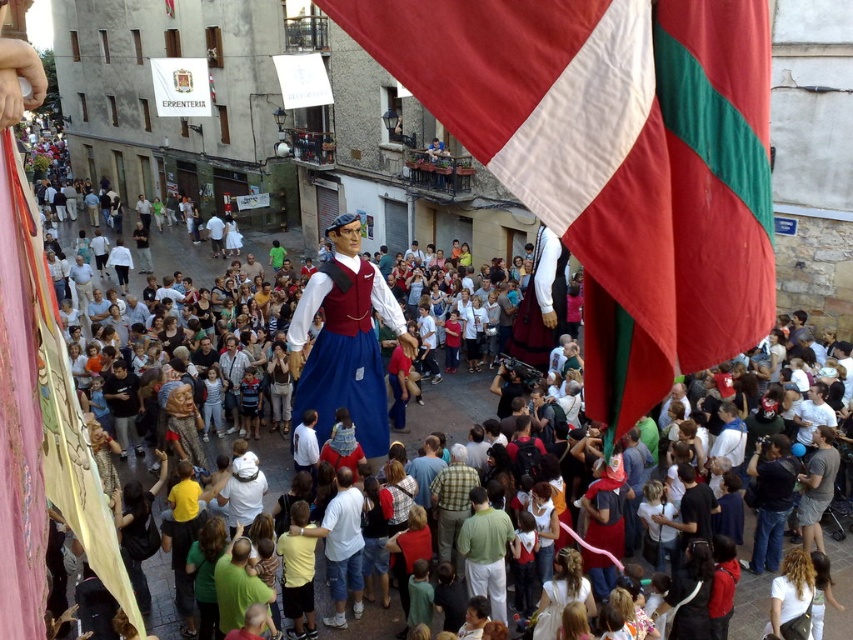
Describe the element at coordinates (345, 340) in the screenshot. I see `velvet blue costume at center` at that location.

Can you confirm if velvet blue costume at center is shorter than green plaid shirt at center?

No, velvet blue costume at center is not shorter than green plaid shirt at center.

Who is more forward, (349, 250) or (437, 512)?

Point (437, 512)

Where is `velvet blue costume at center`? The width and height of the screenshot is (853, 640). velvet blue costume at center is located at coordinates (345, 340).

Between point (479, 572) and point (459, 492), which one is positioned behind?

The point (459, 492) is more distant.

Who is lower down, green cotton shirt at center or green plaid shirt at center?

green cotton shirt at center

Is point (502, 618) in front of point (451, 541)?

Yes, it is.

Image resolution: width=853 pixels, height=640 pixels. I want to click on green cotton shirt at center, so click(485, 552).

Can you confirm if red fabric flag at center is bigger than green plaid shirt at center?

Correct, red fabric flag at center is larger in size than green plaid shirt at center.

Is point (602, 3) more distant than point (469, 472)?

No.

Identify the location of red fabric flag at center. The height and width of the screenshot is (640, 853). (613, 160).